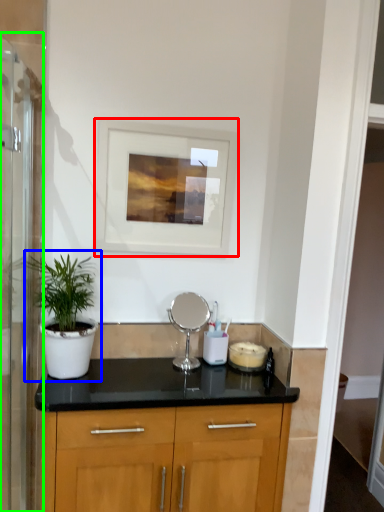
Question: Which object is the farthest from picture frame (highlighted by a red box)? Choose among these: houseplant (highlighted by a blue box) or screen door (highlighted by a green box).

Choices:
 (A) houseplant
 (B) screen door

Answer: (B)